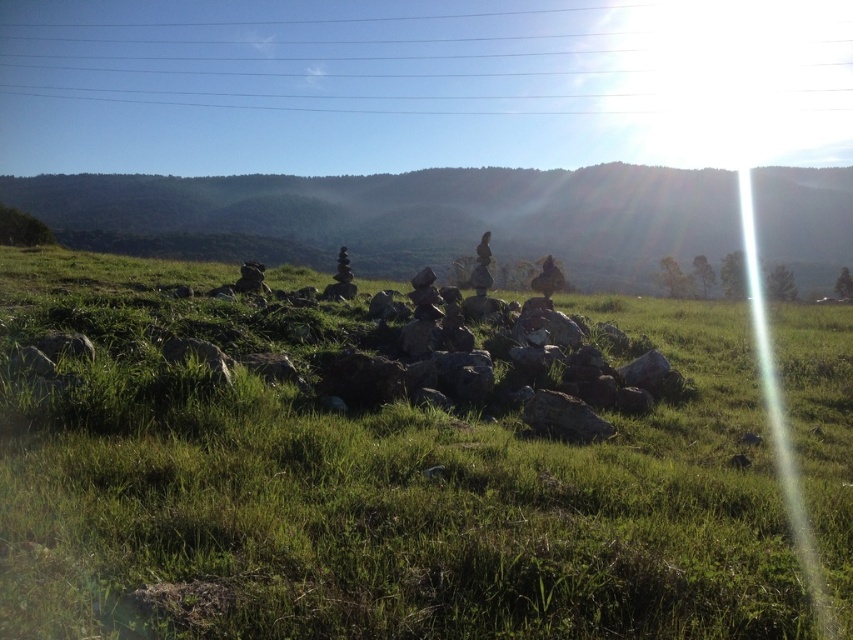
You are standing in the serene outdoor scene and want to place a small flag at each of the two points labeled point (715, 440) and point (326, 44). Which point will have its flag closer to your eyes?

Point (715, 440) is closer to the camera than point (326, 44), so the flag placed at point (715, 440) will be closer to your eyes.

You are a hiker trying to decide which path to take. You see the green grassy hillside at center and the metallic wire at upper center. Which path is narrower?

The green grassy hillside at center has a lesser width compared to the metallic wire at upper center, so the green grassy hillside at center is the narrower path.

You are planning to set up a tent for a camping trip and need to choose between the green grassy hillside at center and the metallic wire at upper center. Which location is more spacious for setting up a tent?

The metallic wire at upper center is larger than the green grassy hillside at center, so it would be more spacious for setting up a tent.